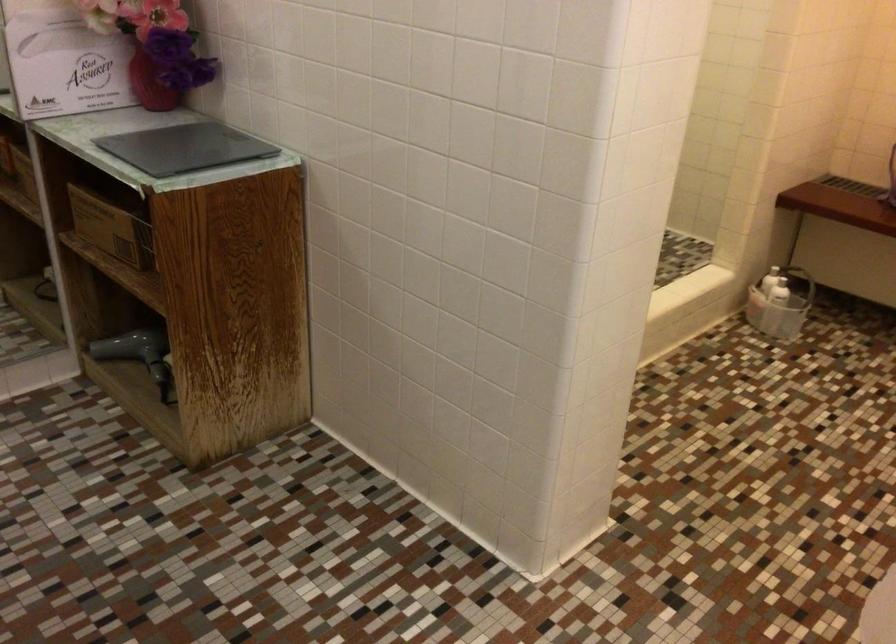
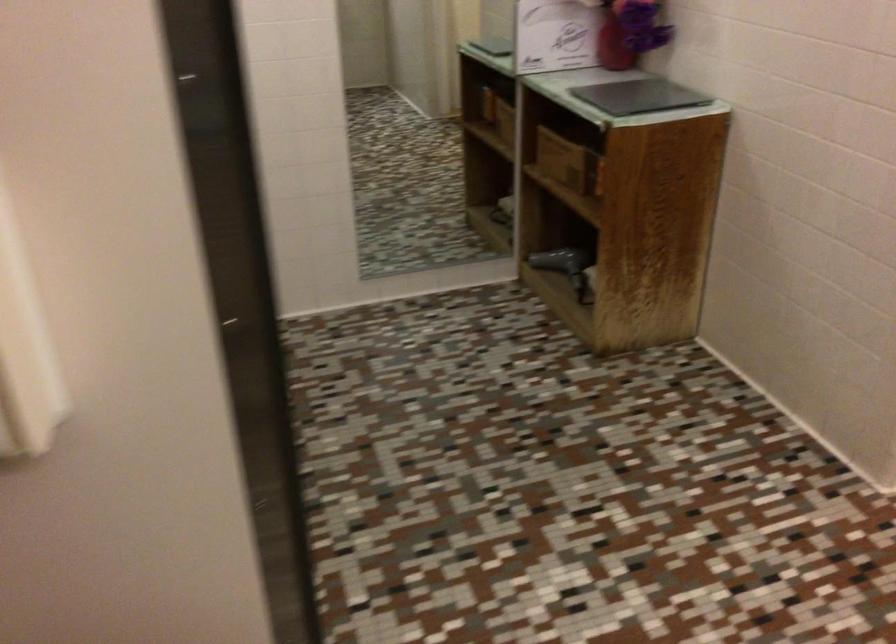
Find the pixel in the second image that matches (76,67) in the first image.

(556, 35)